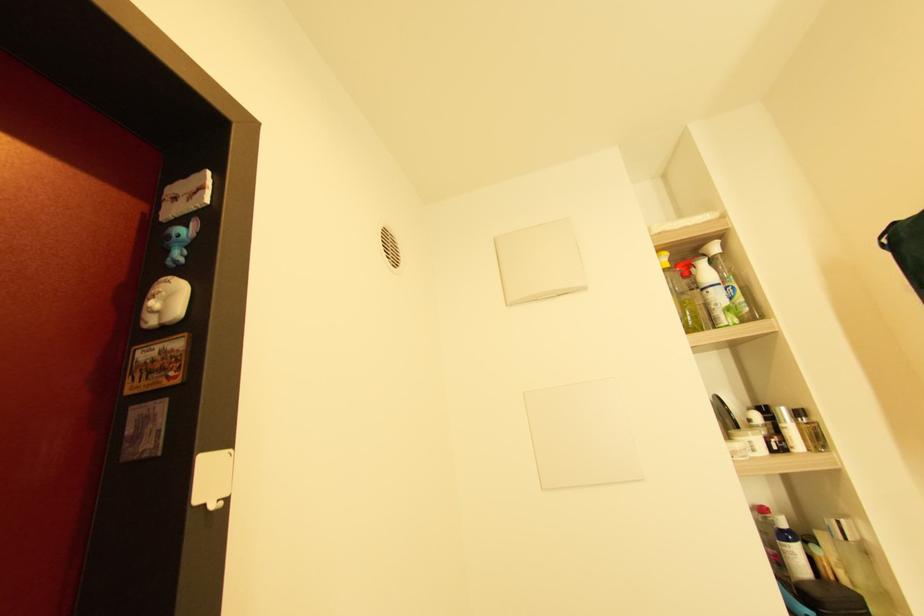
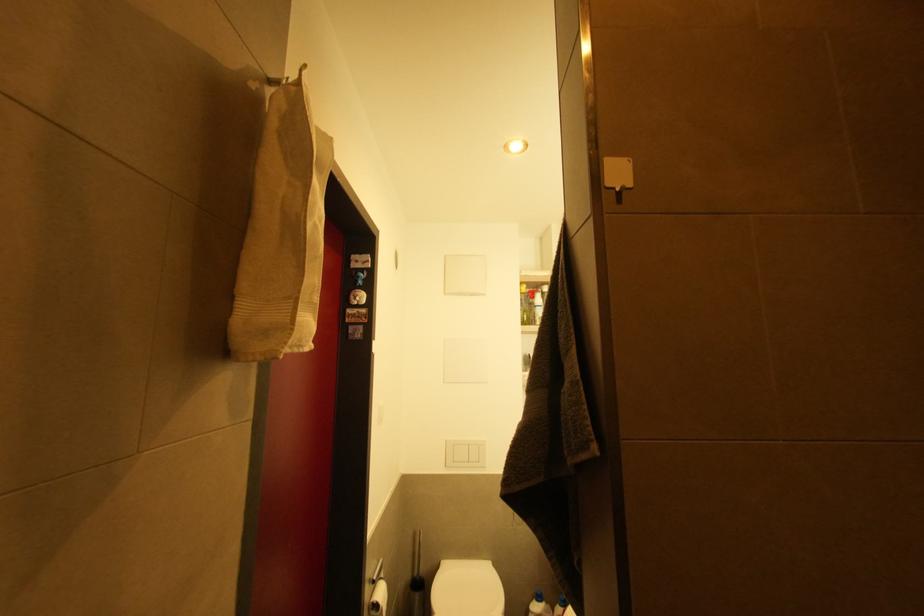
Question: The images are taken continuously from a first-person perspective. In which direction are you moving?

Choices:
 (A) Left
 (B) Right
 (C) Forward
 (D) Backward

Answer: (D)